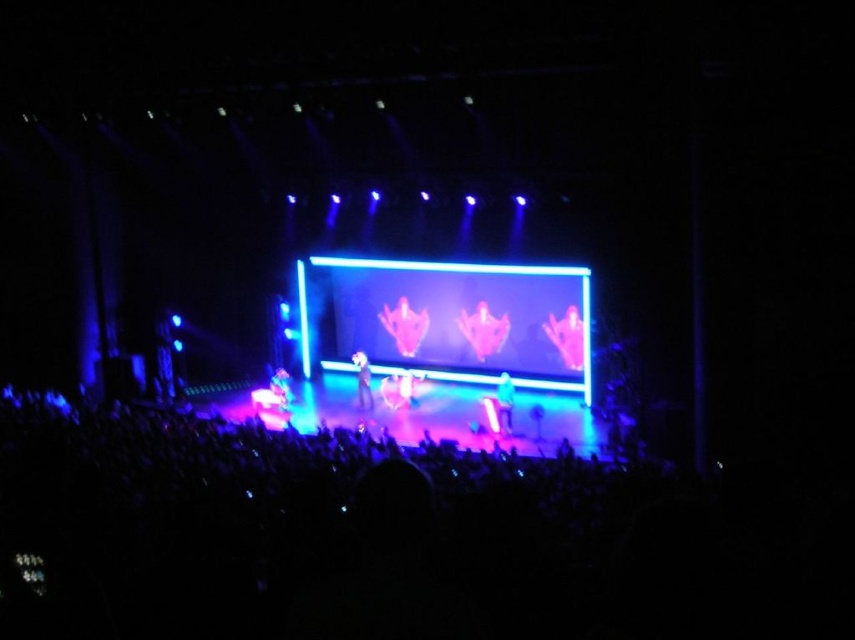
How much distance is there between pink neon screen at center and shiny silver microphone at center?

The distance of pink neon screen at center from shiny silver microphone at center is 3.23 meters.

Does pink neon screen at center have a greater height compared to shiny silver microphone at center?

Correct, pink neon screen at center is much taller as shiny silver microphone at center.

Describe the element at coordinates (449, 320) in the screenshot. I see `pink neon screen at center` at that location.

Identify the location of pink neon screen at center. (449, 320).

Does point (576, 364) come farther from viewer compared to point (282, 403)?

Yes, point (576, 364) is behind point (282, 403).

Who is more distant from viewer, (458, 307) or (282, 388)?

Positioned behind is point (458, 307).

Identify the location of pink neon screen at center. This screenshot has height=640, width=855. (449, 320).

Is pink fabric person at center thinner than neon pink fabric at center?

No.

In the scene shown: Is pink fabric person at center to the right of neon pink fabric at center from the viewer's perspective?

Correct, you'll find pink fabric person at center to the right of neon pink fabric at center.

Which is in front, point (491, 314) or point (292, 396)?

Point (292, 396) is more forward.

Find the location of a particular element. pink fabric person at center is located at coordinates tap(482, 330).